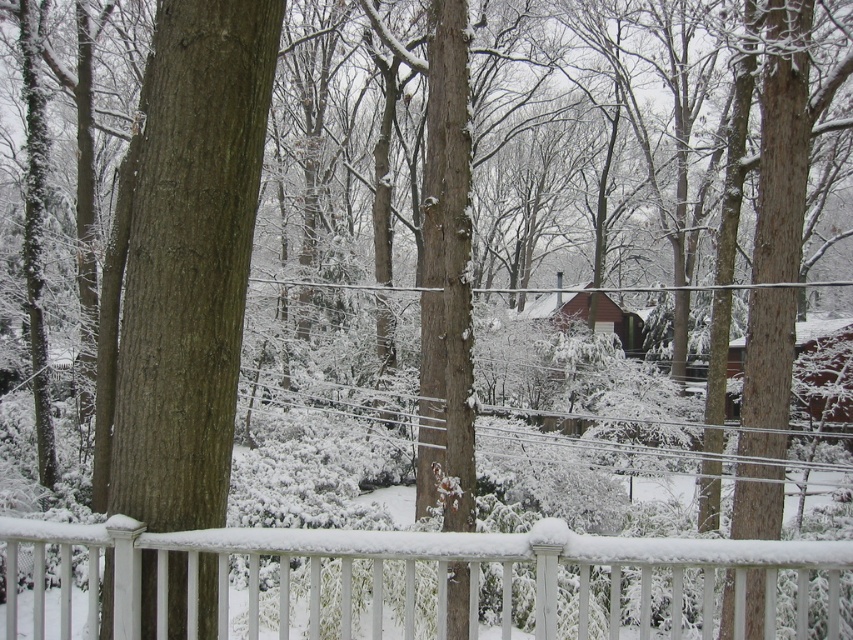
You are standing behind the white painted wood rail at lower center and want to walk towards the brown rough bark tree at left. Is the tree farther away from you than the rail?

Yes, the brown rough bark tree at left is farther away from you than the white painted wood rail at lower center because the rail is closer to the viewer.

You are standing behind the white wooden railing and want to walk towards the two points marked in the image. Which point, point (541,525) or point (166,161), will you reach first?

Point (541,525) is in front of point (166,161), so you will reach point (541,525) first.

You are standing at the edge of a snowy deck and want to place a small snowman exactly at the center of the white painted wood rail at lower center. According to the scene description, where should you position the snowman relative to the rail?

The snowman should be placed at the center of the white painted wood rail at lower center, which is located at point 0.912 on the horizontal axis and 0.487 on the vertical axis according to the coordinates provided.